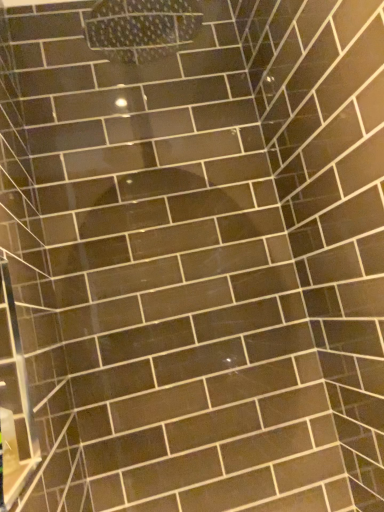
What do you see at coordinates (142, 28) in the screenshot? This screenshot has height=512, width=384. I see `matte black showerhead at upper center` at bounding box center [142, 28].

Identify the location of matte black showerhead at upper center. (142, 28).

Identify the location of matte black showerhead at upper center. pyautogui.click(x=142, y=28).